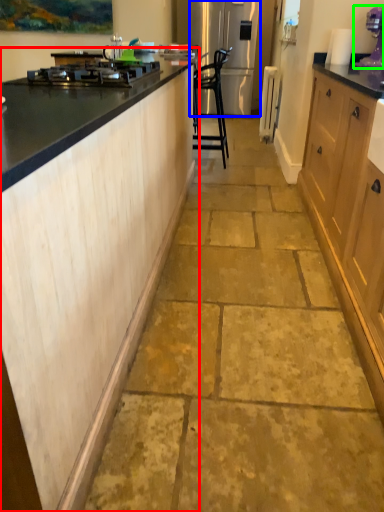
Question: Which is farther away from cabinetry (highlighted by a red box)? refrigerator (highlighted by a blue box) or kitchen appliance (highlighted by a green box)?

Choices:
 (A) refrigerator
 (B) kitchen appliance

Answer: (A)